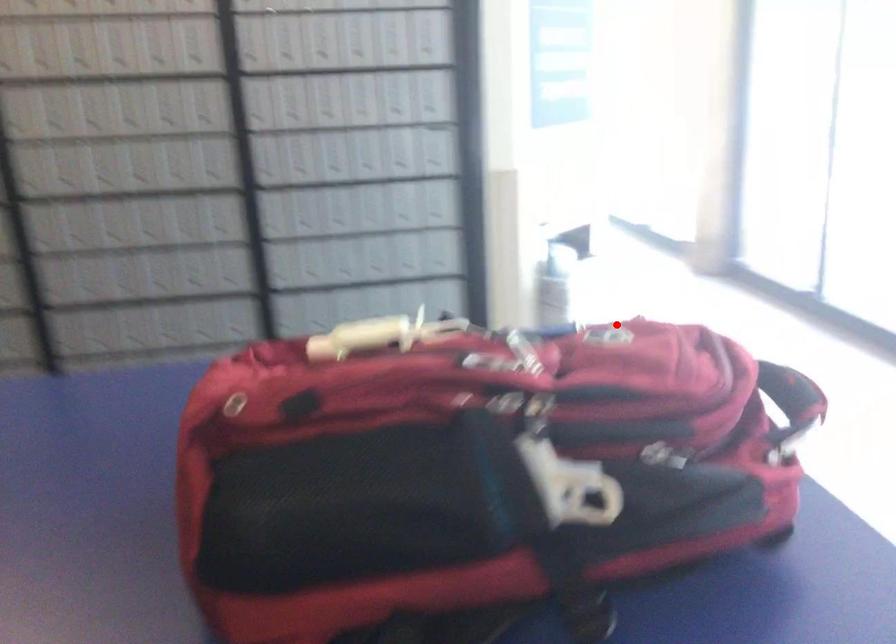
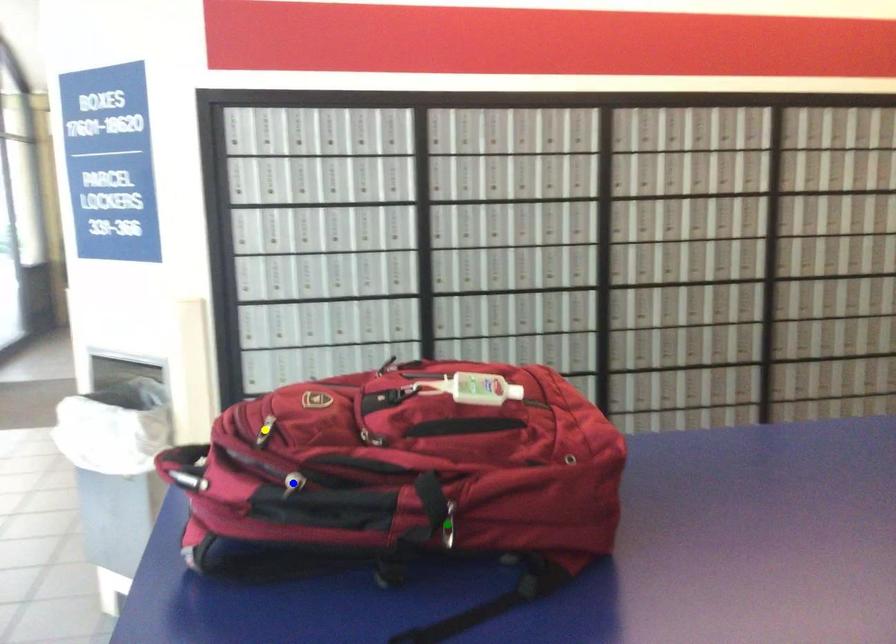
Question: I am providing you with two images of the same scene from different viewpoints. A red point is marked on the first image. You are given multiple points on the second image. In image 2, which mark is for the same physical point as the one in image 1?

Choices:
 (A) green point
 (B) yellow point
 (C) blue point

Answer: (B)